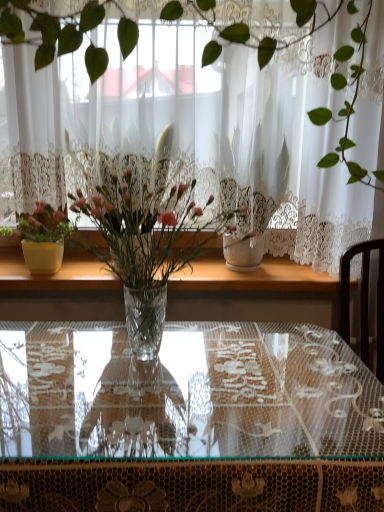
Locate an element on the screen. This screenshot has width=384, height=512. transparent glass table at center is located at coordinates (188, 420).

Describe the element at coordinates (224, 117) in the screenshot. I see `white lace curtain at center` at that location.

Locate an element on the screen. The height and width of the screenshot is (512, 384). clear wood window sill at center is located at coordinates (252, 277).

Describe the element at coordinates (252, 277) in the screenshot. The height and width of the screenshot is (512, 384). I see `clear wood window sill at center` at that location.

Identify the location of transparent glass table at center. Image resolution: width=384 pixels, height=512 pixels. (188, 420).

Is clear glass vase at center, which appears as the first houseplant when viewed from the front, oriented towards clear wood window sill at center?

No, clear glass vase at center, which appears as the first houseplant when viewed from the front, is not facing towards clear wood window sill at center.

From the picture: Is clear glass vase at center, positioned as the 2th houseplant in left-to-right order, bigger or smaller than clear wood window sill at center?

Clearly, clear glass vase at center, positioned as the 2th houseplant in left-to-right order, is larger in size than clear wood window sill at center.

Image resolution: width=384 pixels, height=512 pixels. In order to click on window sill behind the clear glass vase at center, which is the 1th houseplant from right to left in this screenshot , I will do tap(252, 277).

From a real-world perspective, who is located lower, clear wood window sill at center or clear glass vase at center, which is the 2th houseplant in back-to-front order?

clear wood window sill at center.

Considering the relative sizes of clear wood window sill at center and clear glass vase at center, positioned as the 2th houseplant in left-to-right order, in the image provided, is clear wood window sill at center taller than clear glass vase at center, positioned as the 2th houseplant in left-to-right order,?

No.

Who is bigger, clear wood window sill at center or clear glass vase at center, which appears as the first houseplant when viewed from the front?

Bigger between the two is clear glass vase at center, which appears as the first houseplant when viewed from the front.

Locate an element on the screen. window sill located below the clear glass vase at center, positioned as the 2th houseplant in left-to-right order (from the image's perspective) is located at coordinates (252, 277).

Considering the positions of point (260, 142) and point (95, 373), is point (260, 142) closer or farther from the camera than point (95, 373)?

Clearly, point (260, 142) is more distant from the camera than point (95, 373).

Can you confirm if white lace curtain at center is positioned to the left of transparent glass table at center?

No.

How different are the orientations of white lace curtain at center and transparent glass table at center in degrees?

They differ by 0.563 degrees in their facing directions.

From the image's perspective, who appears lower, white lace curtain at center or transparent glass table at center?

From the image's view, transparent glass table at center is below.

From the image's perspective, which is above, clear glass vase at center, which is the 2th houseplant in back-to-front order, or white lace curtain at center?

white lace curtain at center is shown above in the image.

Considering the sizes of objects clear glass vase at center, which is the 1th houseplant from right to left, and white lace curtain at center in the image provided, who is wider, clear glass vase at center, which is the 1th houseplant from right to left, or white lace curtain at center?

clear glass vase at center, which is the 1th houseplant from right to left.

Is clear glass vase at center, positioned as the 2th houseplant in left-to-right order, positioned with its back to white lace curtain at center?

Correct, clear glass vase at center, positioned as the 2th houseplant in left-to-right order, is looking away from white lace curtain at center.

Would you say clear glass vase at center, which appears as the first houseplant when viewed from the front, is outside white lace curtain at center?

Yes, clear glass vase at center, which appears as the first houseplant when viewed from the front, is outside of white lace curtain at center.

Find the location of `the 2nd houseplant below when counting from the white lace curtain at center (from the image's perspective)`. the 2nd houseplant below when counting from the white lace curtain at center (from the image's perspective) is located at coordinates (145, 249).

From a real-world perspective, is white lace curtain at center under clear glass vase at center, positioned as the 2th houseplant in left-to-right order?

Incorrect, from a real-world perspective, white lace curtain at center is higher than clear glass vase at center, positioned as the 2th houseplant in left-to-right order.

From the image's perspective, who appears lower, white lace curtain at center or clear glass vase at center, which is the 2th houseplant in back-to-front order?

clear glass vase at center, which is the 2th houseplant in back-to-front order, from the image's perspective.

In the scene shown: Does clear wood window sill at center turn towards matte yellow pot at left, which appears as the 2th houseplant when viewed from the right?

No, clear wood window sill at center is not turned towards matte yellow pot at left, which appears as the 2th houseplant when viewed from the right.

Is clear wood window sill at center to the left or to the right of matte yellow pot at left, the first houseplant from the back, in the image?

clear wood window sill at center is to the right of matte yellow pot at left, the first houseplant from the back.

Who is shorter, clear wood window sill at center or matte yellow pot at left, marked as the 1th houseplant in a left-to-right arrangement?

Standing shorter between the two is clear wood window sill at center.

Is clear wood window sill at center positioned in front of matte yellow pot at left, marked as the 1th houseplant in a left-to-right arrangement?

No, the depth of clear wood window sill at center is greater than that of matte yellow pot at left, marked as the 1th houseplant in a left-to-right arrangement.

Which is behind, clear wood window sill at center or transparent glass table at center?

clear wood window sill at center is further from the camera.

From the picture: Is clear wood window sill at center at the right side of transparent glass table at center?

No.

Is clear wood window sill at center touching transparent glass table at center?

There is a gap between clear wood window sill at center and transparent glass table at center.

Is clear wood window sill at center outside of transparent glass table at center?

Indeed, clear wood window sill at center is completely outside transparent glass table at center.

Identify the location of window sill behind the clear glass vase at center, which appears as the first houseplant when viewed from the front. (252, 277).

You are a GUI agent. You are given a task and a screenshot of the screen. Output one action in this format:
    pyautogui.click(x=<x>, y=<y>)
    Task: Click on the houseplant that is the 1st object located above the clear wood window sill at center (from the image's perspective)
    The width and height of the screenshot is (384, 512).
    Given the screenshot: What is the action you would take?
    pyautogui.click(x=145, y=249)

In the scene shown: Estimate the real-world distances between objects in this image. Which object is further from clear glass vase at center, positioned as the 2th houseplant in left-to-right order, white lace curtain at center or matte yellow pot at left, the second houseplant positioned from the front?

white lace curtain at center lies further to clear glass vase at center, positioned as the 2th houseplant in left-to-right order, than the other object.

When comparing their distances from transparent glass table at center, does clear glass vase at center, positioned as the 2th houseplant in left-to-right order, or white lace curtain at center seem closer?

clear glass vase at center, positioned as the 2th houseplant in left-to-right order, is positioned closer to the anchor transparent glass table at center.

Looking at the image, which one is located closer to transparent glass table at center, matte yellow pot at left, marked as the 1th houseplant in a left-to-right arrangement, or clear wood window sill at center?

Based on the image, matte yellow pot at left, marked as the 1th houseplant in a left-to-right arrangement, appears to be nearer to transparent glass table at center.

Considering their positions, is clear wood window sill at center positioned closer to white lace curtain at center than matte yellow pot at left, marked as the 1th houseplant in a left-to-right arrangement?

clear wood window sill at center is closer to white lace curtain at center.

Based on their spatial positions, is clear glass vase at center, positioned as the 2th houseplant in left-to-right order, or transparent glass table at center further from clear wood window sill at center?

The object further to clear wood window sill at center is transparent glass table at center.

Considering their positions, is clear glass vase at center, which is the 2th houseplant in back-to-front order, positioned further to white lace curtain at center than clear wood window sill at center?

clear wood window sill at center.

Estimate the real-world distances between objects in this image. Which object is closer to clear wood window sill at center, matte yellow pot at left, which appears as the 2th houseplant when viewed from the right, or white lace curtain at center?

matte yellow pot at left, which appears as the 2th houseplant when viewed from the right, lies closer to clear wood window sill at center than the other object.

Which object lies further to the anchor point white lace curtain at center, clear wood window sill at center or transparent glass table at center?

Among the two, transparent glass table at center is located further to white lace curtain at center.

Where is `houseplant located between transparent glass table at center and matte yellow pot at left, which appears as the 2th houseplant when viewed from the right, in the depth direction`? The width and height of the screenshot is (384, 512). houseplant located between transparent glass table at center and matte yellow pot at left, which appears as the 2th houseplant when viewed from the right, in the depth direction is located at coordinates (145, 249).

Identify the location of window sill between matte yellow pot at left, which appears as the 2th houseplant when viewed from the right, and white lace curtain at center, in the horizontal direction. (252, 277).

Locate an element on the screen. The width and height of the screenshot is (384, 512). houseplant located between clear glass vase at center, which is the 1th houseplant from right to left, and clear wood window sill at center in the depth direction is located at coordinates (43, 238).

I want to click on curtain located between clear glass vase at center, which appears as the first houseplant when viewed from the front, and matte yellow pot at left, the second houseplant positioned from the front, in the depth direction, so click(x=224, y=117).